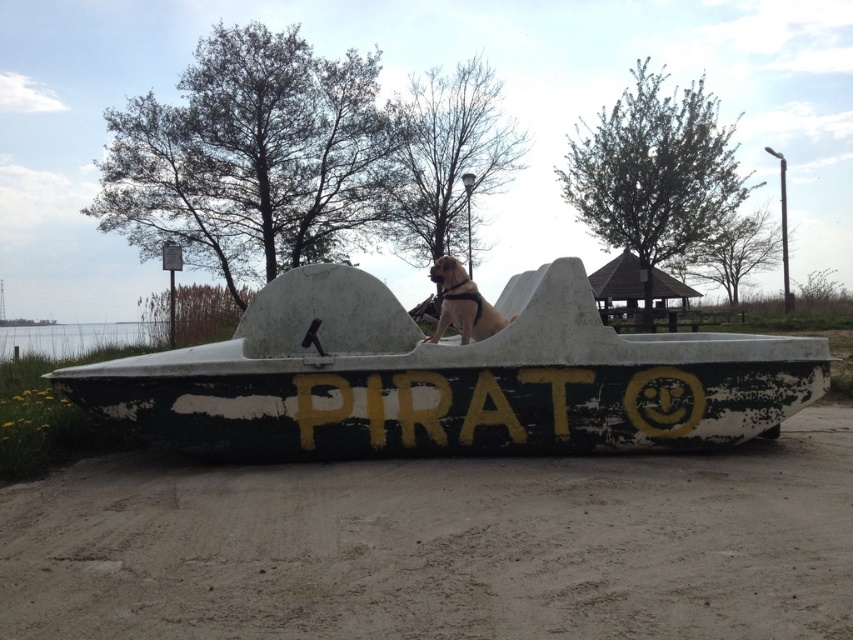
You are driving a car that is 1.8 meters wide. You need to navigate from the brown textured dirt track at center to the green weathered boat at center. Can your car pass through the track to reach the boat?

The brown textured dirt track at center is wider than the green weathered boat at center, so yes, the car can pass through the track to reach the green weathered boat at center since the track is wide enough.

You are standing on the brown textured dirt track at center and want to board the green weathered boat at center. Which direction should you move to reach the boat?

The green weathered boat at center is higher than the brown textured dirt track at center, so you should move upwards to reach the boat.

You are standing on the brown textured dirt track at center and want to see the golden fur dog at center. Since the track is lower than the dog, will you need to look up or down to see the dog?

The brown textured dirt track at center has a lesser height compared to golden fur dog at center, so you will need to look up to see the golden fur dog at center.